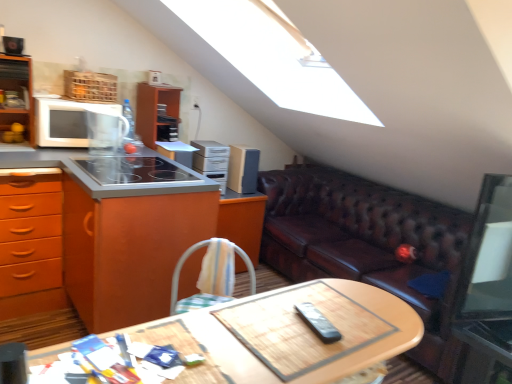
Where is `vacant space to the right of black plastic remote at center, acting as the 1th appliance starting from the right`? This screenshot has width=512, height=384. vacant space to the right of black plastic remote at center, acting as the 1th appliance starting from the right is located at coordinates (366, 329).